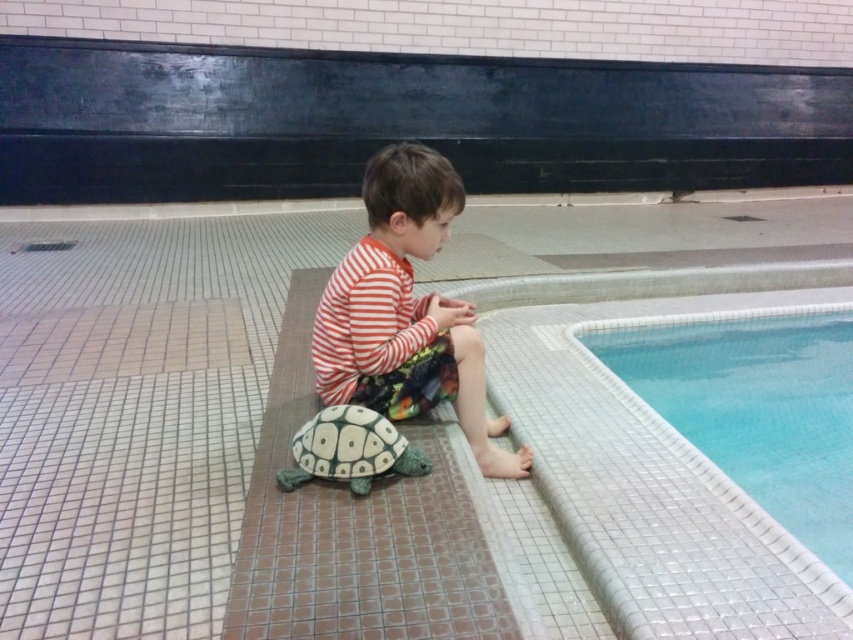
Who is more forward, (834, 465) or (329, 326)?

Point (329, 326)

What do you see at coordinates (750, 406) in the screenshot? The width and height of the screenshot is (853, 640). I see `white mosaic tile at upper right` at bounding box center [750, 406].

Is point (758, 456) less distant than point (465, 336)?

That is False.

Where is `white mosaic tile at upper right`? Image resolution: width=853 pixels, height=640 pixels. white mosaic tile at upper right is located at coordinates coord(750,406).